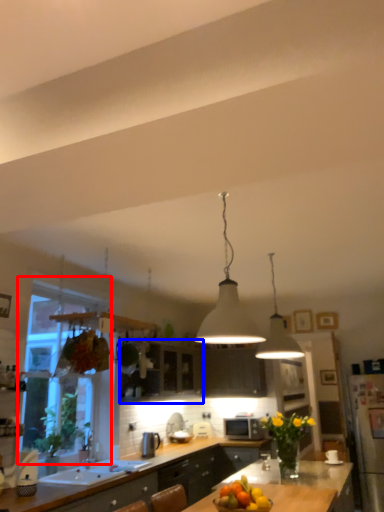
Question: Which object appears closest to the camera in this image, window (highlighted by a red box) or cabinetry (highlighted by a blue box)?

Choices:
 (A) window
 (B) cabinetry

Answer: (A)